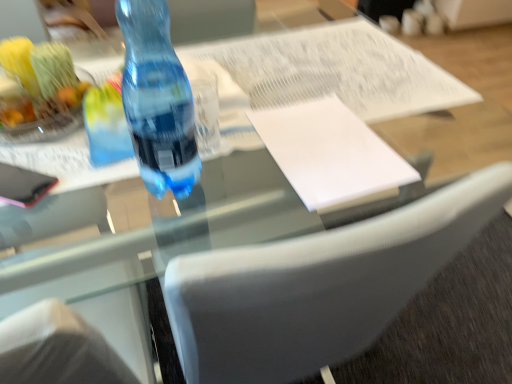
Measure the distance between point (343, 123) and camera.

They are 85.20 centimeters apart.

Identify the location of transparent plastic bottle at center. (205, 109).

I want to click on shiny plastic fruit bowl at upper left, so click(39, 79).

What's the angular difference between white paper at center and blue translucent bottle at center's facing directions?

white paper at center and blue translucent bottle at center are facing 0.102 degrees away from each other.

Looking at the image, does white paper at center seem bigger or smaller compared to blue translucent bottle at center?

white paper at center is smaller than blue translucent bottle at center.

Based on their positions, is white paper at center located to the left or right of blue translucent bottle at center?

white paper at center is to the right of blue translucent bottle at center.

The width and height of the screenshot is (512, 384). What are the coordinates of `journal behind the blue translucent bottle at center` in the screenshot? It's located at (329, 152).

Considering the points (198, 141) and (295, 186), which point is behind, point (198, 141) or point (295, 186)?

The point (198, 141) is farther.

How different are the orientations of transparent plastic bottle at center and white paper at center in degrees?

The angle between the facing direction of transparent plastic bottle at center and the facing direction of white paper at center is 4.18 degrees.

Based on the photo, between transparent plastic bottle at center and white paper at center, which one has smaller size?

transparent plastic bottle at center is smaller.

Is white paper at center completely or partially inside transparent plastic bottle at center?

Definitely not — white paper at center is not inside transparent plastic bottle at center.

Considering the points (168, 33) and (65, 56), which point is behind, point (168, 33) or point (65, 56)?

The point (65, 56) is behind.

Is blue translucent bottle at center facing towards shiny plastic fruit bowl at upper left?

No, blue translucent bottle at center is not facing towards shiny plastic fruit bowl at upper left.

Which object is more forward, blue translucent bottle at center or shiny plastic fruit bowl at upper left?

blue translucent bottle at center is closer to the camera.

Can you confirm if blue translucent bottle at center is wider than shiny plastic fruit bowl at upper left?

In fact, blue translucent bottle at center might be narrower than shiny plastic fruit bowl at upper left.

Is shiny plastic fruit bowl at upper left with white paper at center?

No, shiny plastic fruit bowl at upper left is not touching white paper at center.

Looking at the image, does shiny plastic fruit bowl at upper left seem bigger or smaller compared to white paper at center?

Clearly, shiny plastic fruit bowl at upper left is larger in size than white paper at center.

Between shiny plastic fruit bowl at upper left and white paper at center, which one appears on the right side from the viewer's perspective?

white paper at center.

At what (x,y) coordinates should I click in order to perform the action: click on bottle in front of the white paper at center. Please return your answer as a coordinate pair (x, y). Image resolution: width=512 pixels, height=384 pixels. Looking at the image, I should click on (157, 100).

Is blue translucent bottle at center spatially inside white paper at center, or outside of it?

blue translucent bottle at center lies outside white paper at center.

Consider the image. Based on their positions, is blue translucent bottle at center located to the left or right of white paper at center?

Clearly, blue translucent bottle at center is on the left of white paper at center in the image.

Is white paper at center touching shiny plastic fruit bowl at upper left?

white paper at center and shiny plastic fruit bowl at upper left are clearly separated.

From a real-world perspective, who is located lower, white paper at center or shiny plastic fruit bowl at upper left?

From a 3D spatial view, white paper at center is below.

Considering the positions of points (323, 111) and (86, 83), is point (323, 111) farther from camera compared to point (86, 83)?

That is False.

From the image's perspective, would you say transparent plastic bottle at center is positioned over shiny plastic fruit bowl at upper left?

No, from the image's perspective, transparent plastic bottle at center is not above shiny plastic fruit bowl at upper left.

Is transparent plastic bottle at center at the left side of shiny plastic fruit bowl at upper left?

No.

Are transparent plastic bottle at center and shiny plastic fruit bowl at upper left beside each other?

No, transparent plastic bottle at center is not beside shiny plastic fruit bowl at upper left.

Identify the location of bottle on the left of the white paper at center. The height and width of the screenshot is (384, 512). (157, 100).

I want to click on journal located in front of the transparent plastic bottle at center, so click(x=329, y=152).

Looking at the image, which one is located closer to blue translucent bottle at center, transparent plastic bottle at center or white paper at center?

transparent plastic bottle at center is positioned closer to the anchor blue translucent bottle at center.

When comparing their distances from white paper at center, does shiny plastic fruit bowl at upper left or transparent plastic bottle at center seem further?

shiny plastic fruit bowl at upper left is positioned further to the anchor white paper at center.

Estimate the real-world distances between objects in this image. Which object is further from shiny plastic fruit bowl at upper left, blue translucent bottle at center or transparent plastic bottle at center?

transparent plastic bottle at center.

Estimate the real-world distances between objects in this image. Which object is further from transparent plastic bottle at center, shiny plastic fruit bowl at upper left or white paper at center?

Based on the image, shiny plastic fruit bowl at upper left appears to be further to transparent plastic bottle at center.

When comparing their distances from shiny plastic fruit bowl at upper left, does white paper at center or blue translucent bottle at center seem further?

white paper at center lies further to shiny plastic fruit bowl at upper left than the other object.

Based on their spatial positions, is blue translucent bottle at center or white paper at center closer to shiny plastic fruit bowl at upper left?

blue translucent bottle at center.

Based on their spatial positions, is transparent plastic bottle at center or white paper at center further from shiny plastic fruit bowl at upper left?

Among the two, white paper at center is located further to shiny plastic fruit bowl at upper left.

When comparing their distances from transparent plastic bottle at center, does shiny plastic fruit bowl at upper left or blue translucent bottle at center seem closer?

blue translucent bottle at center is closer to transparent plastic bottle at center.

In order to click on bottle located between shiny plastic fruit bowl at upper left and transparent plastic bottle at center in the left-right direction in this screenshot , I will do `click(157, 100)`.

Where is `clear between blue translucent bottle at center and white paper at center from left to right`? This screenshot has height=384, width=512. clear between blue translucent bottle at center and white paper at center from left to right is located at coordinates (205, 109).

Where is `clear between shiny plastic fruit bowl at upper left and white paper at center`? This screenshot has height=384, width=512. clear between shiny plastic fruit bowl at upper left and white paper at center is located at coordinates (205, 109).

Locate an element on the screen. bottle between shiny plastic fruit bowl at upper left and white paper at center from left to right is located at coordinates (157, 100).